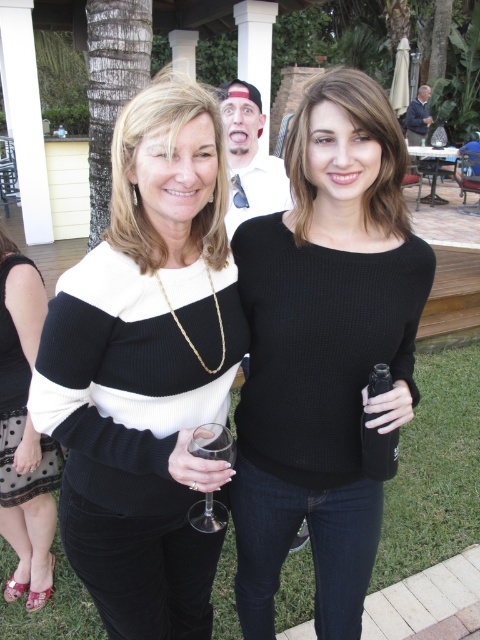
Is black knitted sweater at center below clear glass wine glass at lower center?

Incorrect, black knitted sweater at center is not positioned below clear glass wine glass at lower center.

Who is taller, black knitted sweater at center or clear glass wine glass at lower center?

black knitted sweater at center

You are a GUI agent. You are given a task and a screenshot of the screen. Output one action in this format:
    pyautogui.click(x=<x>, y=<y>)
    Task: Click on the black knitted sweater at center
    
    Given the screenshot: What is the action you would take?
    pyautogui.click(x=145, y=369)

Is point (237, 344) farther from viewer compared to point (0, 404)?

No, it is in front of (0, 404).

Does point (219, 179) come behind point (34, 520)?

No, it is in front of (34, 520).

What are the coordinates of `black knitted sweater at center` in the screenshot? It's located at (145, 369).

Identify the location of black ribbed sweater at center. The height and width of the screenshot is (640, 480). (324, 352).

Between black ribbed sweater at center and black textured sweater at center, which one has less height?

Standing shorter between the two is black textured sweater at center.

Who is more forward, (238,540) or (0,500)?

Point (238,540) is more forward.

I want to click on black ribbed sweater at center, so click(x=324, y=352).